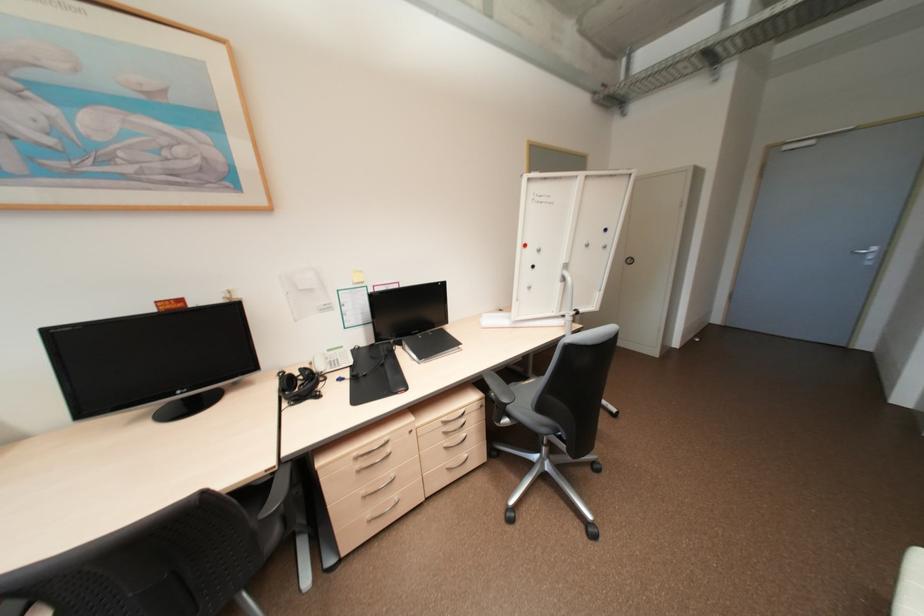
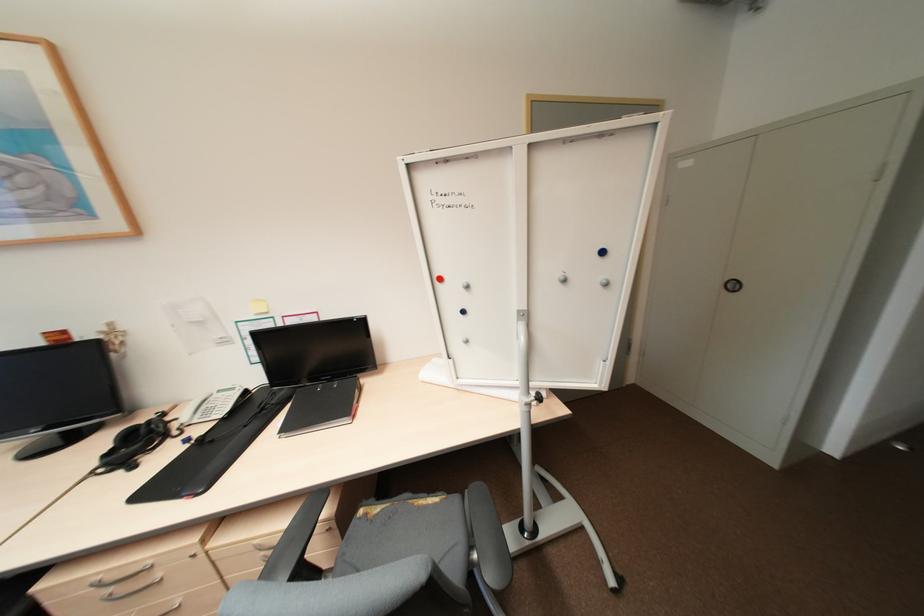
The point at (636, 261) is marked in the first image. Where is the corresponding point in the second image?

(738, 286)